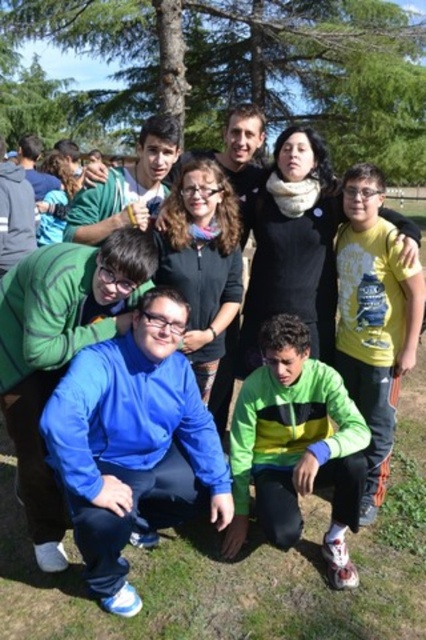
You are a photographer trying to capture a photo of the group while ensuring the green leafy tree at upper center and the blue fleece jacket at center are both visible. Which object should you focus on first to ensure both are in sharp focus?

You should focus on the blue fleece jacket at center first because it is closer to you than the green leafy tree at upper center, which is further away. By focusing on the closer object, the tree will still be in focus due to depth of field, but focusing on the tree might leave the jacket slightly out of focus.

You are a photographer trying to capture a group photo of the blue fleece jacket at center and the green leafy tree at upper center. Which object is wider in the image?

The green leafy tree at upper center is wider than the blue fleece jacket at center.